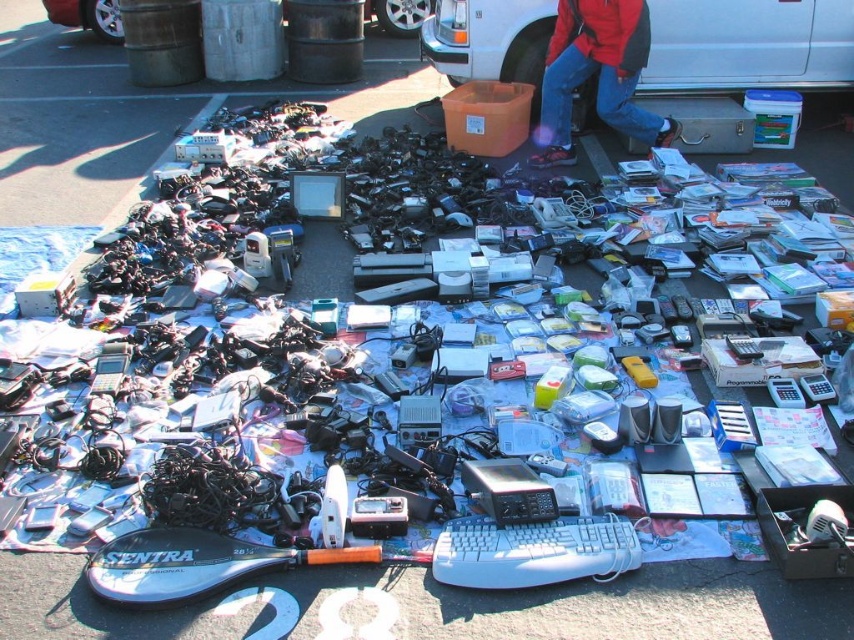
Looking at this image, you are a delivery driver trying to navigate through the scene. You need to move your truck from the current position to the recycling center entrance located behind the white matte van at upper right and the silver metallic van at upper center. Which van should you move first to clear the path?

The white matte van at upper right is positioned on the right side of the silver metallic van at upper center. To clear the path, you should move the silver metallic van at upper center first since it is closer to the entrance and blocking the way before the white matte van at upper right.

You are standing at the edge of the blue tarp with electronic items and notice the white matte van at upper right and the red fabric jacket at upper center. Which object is positioned higher in the image?

The white matte van at upper right is positioned higher than the red fabric jacket at upper center in the image.

You are planning to park a new van that is 2.5 meters wide in this outdoor area. You see the white matte van at upper right and the silver metallic van at upper center. Which van should you compare your van width with to determine if it can fit between them?

You should compare your van width with the white matte van at upper right because it might be wider than the silver metallic van at upper center. If your van is narrower than the white matte van at upper right, it could potentially fit between them.